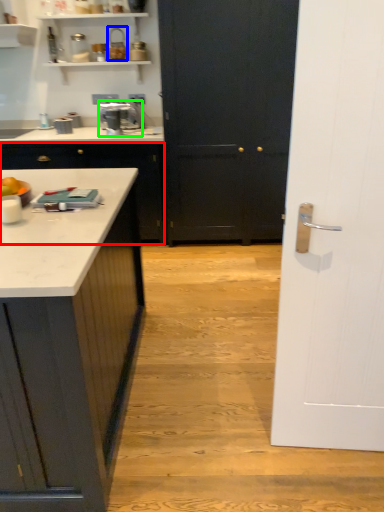
Question: Considering the real-world distances, which object is closest to cabinetry (highlighted by a red box)? appliance (highlighted by a blue box) or home appliance (highlighted by a green box).

Choices:
 (A) appliance
 (B) home appliance

Answer: (B)